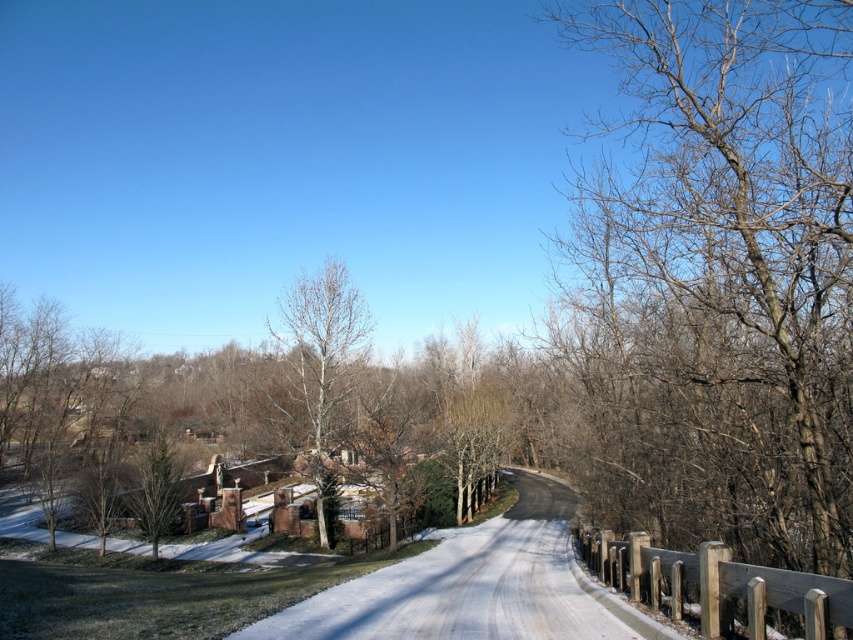
Can you confirm if bare branches at right is positioned below bare wood tree at center?

No, bare branches at right is not below bare wood tree at center.

Is bare branches at right shorter than bare wood tree at center?

Yes.

Is point (682, 248) positioned behind point (287, 326)?

No, (682, 248) is in front of (287, 326).

Locate an element on the screen. This screenshot has width=853, height=640. bare branches at right is located at coordinates tap(723, 275).